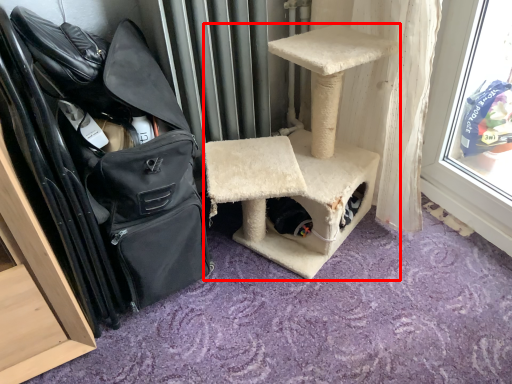
Question: From the image's perspective, considering the relative positions of furniture (annotated by the red box) and shoulder bag in the image provided, where is furniture (annotated by the red box) located with respect to the staircase?

Choices:
 (A) above
 (B) below

Answer: (A)